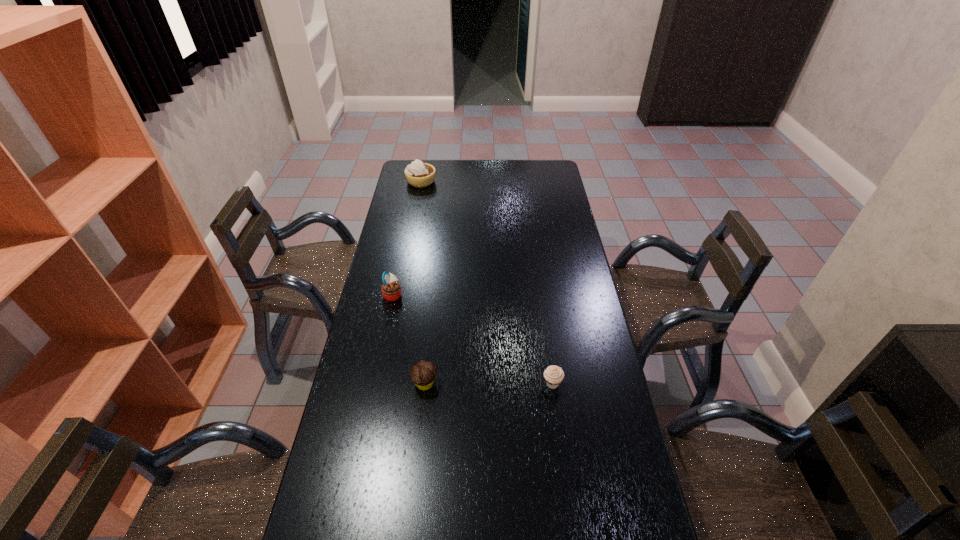
The width and height of the screenshot is (960, 540). I want to click on unoccupied area between the rightmost muffin and the second object from right to left, so coord(489,383).

You are a GUI agent. You are given a task and a screenshot of the screen. Output one action in this format:
    pyautogui.click(x=<x>, y=<y>)
    Task: Click on the free area in between the second muffin from right to left and the rightmost muffin
    
    Given the screenshot: What is the action you would take?
    pyautogui.click(x=489, y=383)

Locate an element on the screen. This screenshot has height=540, width=960. free spot between the farthest muffin and the rightmost object is located at coordinates (472, 339).

The width and height of the screenshot is (960, 540). I want to click on unoccupied position between the whipped cream and the farthest muffin, so click(x=407, y=238).

This screenshot has height=540, width=960. In order to click on free spot between the rightmost muffin and the farthest object in this screenshot , I will do `click(487, 283)`.

Identify the location of free area in between the rightmost muffin and the farthest muffin. (472, 339).

Where is `unoccupied area between the farthest object and the rightmost muffin`? The width and height of the screenshot is (960, 540). unoccupied area between the farthest object and the rightmost muffin is located at coordinates (487, 283).

This screenshot has height=540, width=960. In order to click on object that is the nearest to the rightmost muffin in this screenshot , I will do `click(423, 373)`.

Point out which object is positioned as the nearest to the rightmost muffin. Please provide its 2D coordinates. Your answer should be formatted as a tuple, i.e. [(x, y)], where the tuple contains the x and y coordinates of a point satisfying the conditions above.

[(423, 373)]

This screenshot has width=960, height=540. I want to click on muffin that is the closest one to the second object from right to left, so click(391, 290).